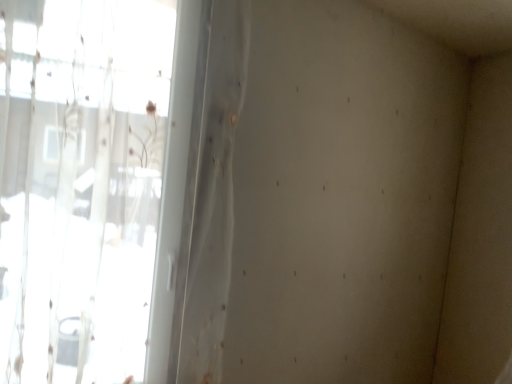
Question: Should I look upward or downward to see transparent fabric at left?

Choices:
 (A) down
 (B) up

Answer: (A)